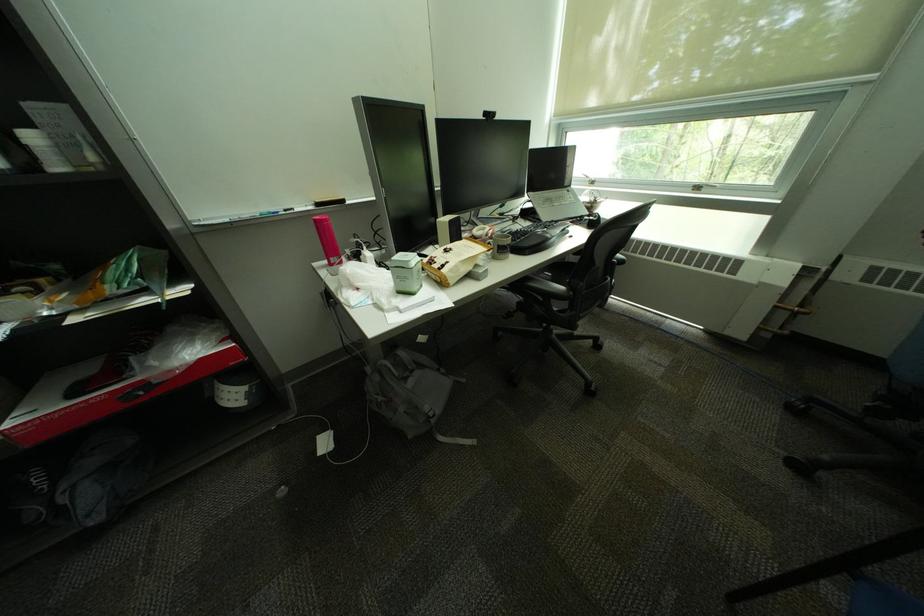
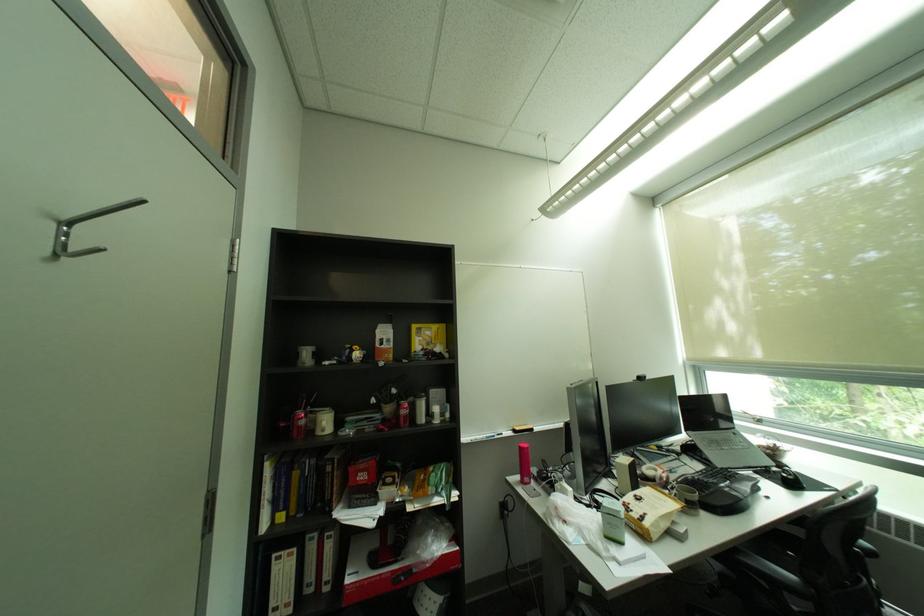
The point at (591,217) is marked in the first image. Where is the corresponding point in the second image?

(777, 468)